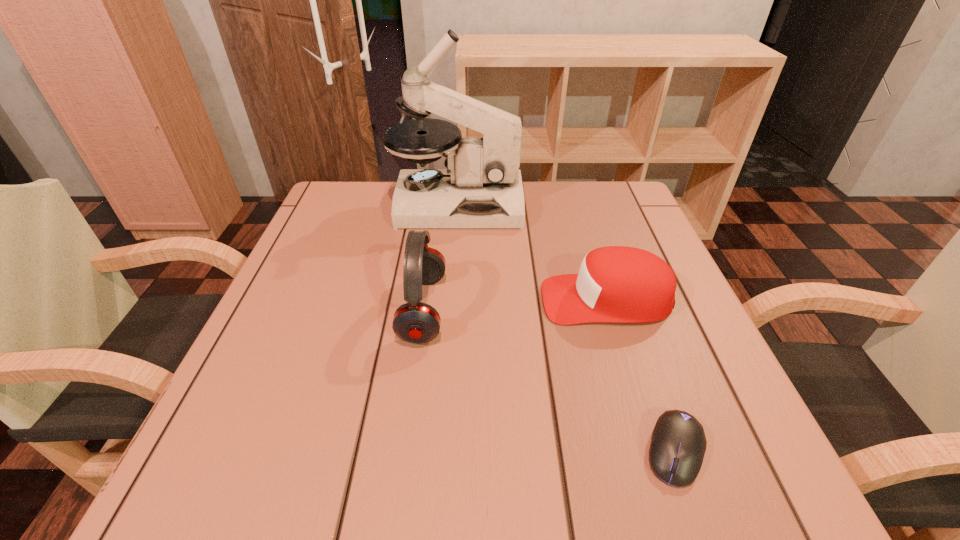
Locate an element on the screen. This screenshot has height=540, width=960. free space located on the front-facing side of the third tallest object is located at coordinates (385, 300).

Where is `vacant region located 0.200m on the left of the computer mouse`? vacant region located 0.200m on the left of the computer mouse is located at coordinates (500, 451).

The image size is (960, 540). Identify the location of object that is at the far edge. (482, 187).

Where is `object at the near edge`? This screenshot has height=540, width=960. object at the near edge is located at coordinates (678, 445).

The image size is (960, 540). Find the location of `baseball cap located at the right edge`. baseball cap located at the right edge is located at coordinates (616, 284).

This screenshot has height=540, width=960. Identify the location of computer mouse that is at the right edge. [x=678, y=445].

You are a GUI agent. You are given a task and a screenshot of the screen. Output one action in this format:
    pyautogui.click(x=<x>, y=<y>)
    Task: Click on the object that is at the near right corner
    The image size is (960, 540).
    Given the screenshot: What is the action you would take?
    pyautogui.click(x=678, y=445)

You are a GUI agent. You are given a task and a screenshot of the screen. Output one action in this format:
    pyautogui.click(x=<x>, y=<y>)
    Task: Click on the free space at the left edge of the desktop
    This screenshot has height=540, width=960.
    Given the screenshot: What is the action you would take?
    pyautogui.click(x=345, y=285)

In the image, there is a desktop. What are the coordinates of `blank space at the right edge` in the screenshot? It's located at (708, 357).

Locate an element on the screen. This screenshot has width=960, height=540. free spot at the far left corner of the desktop is located at coordinates (309, 234).